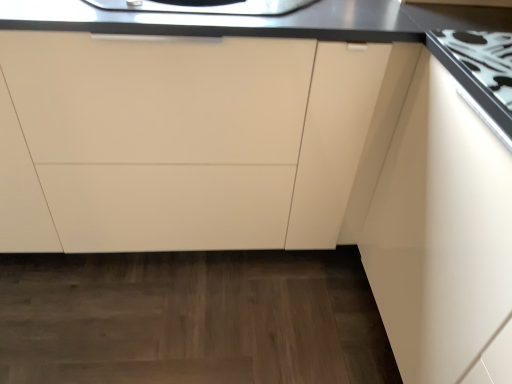
Question: Considering the relative positions of matte white cabinet at center and white glossy gas stove at upper right in the image provided, is matte white cabinet at center to the left or to the right of white glossy gas stove at upper right?

Choices:
 (A) right
 (B) left

Answer: (B)

Question: Is point (260, 188) closer or farther from the camera than point (482, 41)?

Choices:
 (A) closer
 (B) farther

Answer: (B)

Question: From a real-world perspective, is matte white cabinet at center above or below white glossy gas stove at upper right?

Choices:
 (A) above
 (B) below

Answer: (B)

Question: Is white glossy gas stove at upper right taller or shorter than matte white cabinet at center?

Choices:
 (A) tall
 (B) short

Answer: (B)

Question: From a real-world perspective, relative to matte white cabinet at center, is white glossy gas stove at upper right vertically above or below?

Choices:
 (A) below
 (B) above

Answer: (B)

Question: From the image's perspective, is white glossy gas stove at upper right located above or below matte white cabinet at center?

Choices:
 (A) below
 (B) above

Answer: (B)

Question: In terms of width, does white glossy gas stove at upper right look wider or thinner when compared to matte white cabinet at center?

Choices:
 (A) wide
 (B) thin

Answer: (B)